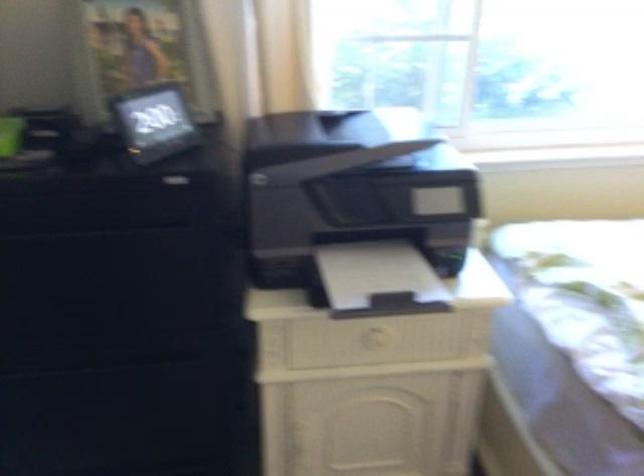
This screenshot has height=476, width=644. What do you see at coordinates (377, 278) in the screenshot?
I see `the white paper sheet` at bounding box center [377, 278].